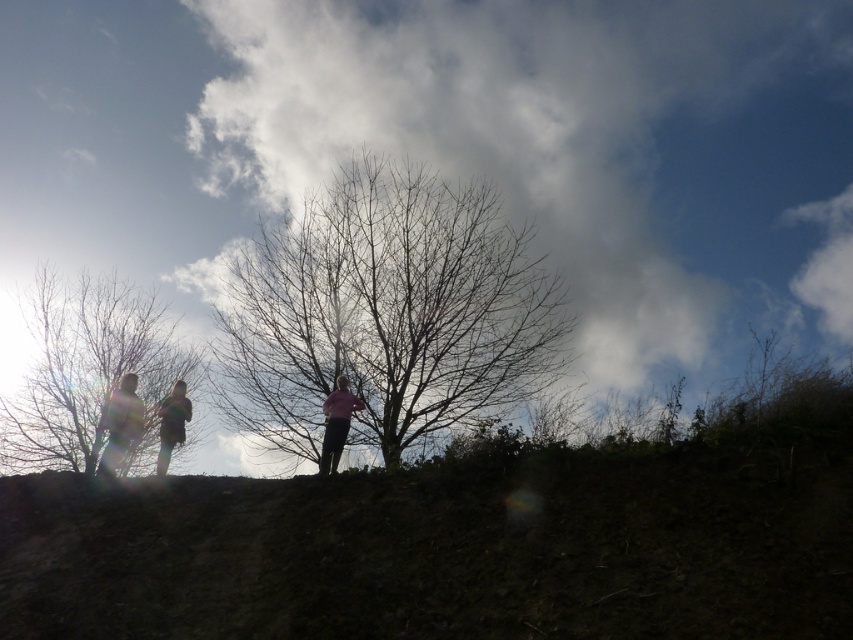
Does point (6, 624) come in front of point (183, 410)?

That is True.

Is dull brown dirt at center wider than silhouette clothing at center?

Correct, the width of dull brown dirt at center exceeds that of silhouette clothing at center.

Does point (126, 518) lie behind point (187, 419)?

No, (126, 518) is closer to viewer.

Locate an element on the screen. The image size is (853, 640). dull brown dirt at center is located at coordinates (463, 540).

Can you confirm if white fluffy cloud at upper center is bigger than bare branches at center?

Yes, white fluffy cloud at upper center is bigger than bare branches at center.

At what (x,y) coordinates should I click in order to perform the action: click on white fluffy cloud at upper center. Please return your answer as a coordinate pair (x, y). Looking at the image, I should click on (579, 148).

Locate an element on the screen. The width and height of the screenshot is (853, 640). white fluffy cloud at upper center is located at coordinates (579, 148).

Does bare branches at left have a greater width compared to silhouette clothing at left?

Yes.

Does bare branches at left appear over silhouette clothing at left?

Incorrect, bare branches at left is not positioned above silhouette clothing at left.

Describe the element at coordinates (88, 371) in the screenshot. This screenshot has width=853, height=640. I see `bare branches at left` at that location.

This screenshot has width=853, height=640. I want to click on bare branches at left, so click(x=88, y=371).